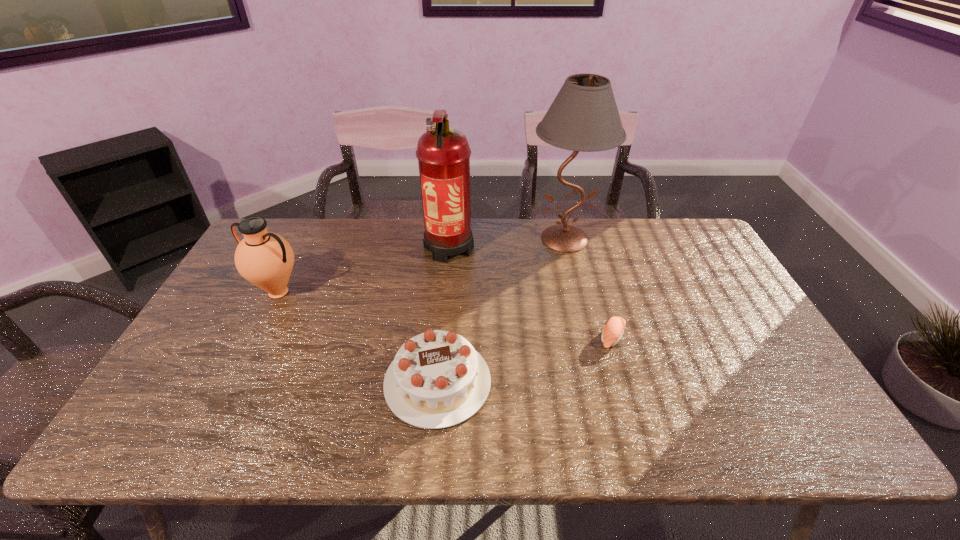
Locate an element on the screen. The image size is (960, 540). free space at the far right corner of the desktop is located at coordinates (667, 237).

You are a GUI agent. You are given a task and a screenshot of the screen. Output one action in this format:
    pyautogui.click(x=<x>, y=<y>)
    Task: Click on the unoccupied area between the fire extinguisher and the shortest object
    Image resolution: width=960 pixels, height=540 pixels.
    Given the screenshot: What is the action you would take?
    pyautogui.click(x=531, y=292)

The image size is (960, 540). I want to click on empty space between the fire extinguisher and the pitcher, so click(364, 269).

Locate an element on the screen. unoccupied position between the birthday cake and the shortest object is located at coordinates (525, 360).

Identify the location of vacant area that lies between the sushi and the fire extinguisher. Image resolution: width=960 pixels, height=540 pixels. (531, 292).

The width and height of the screenshot is (960, 540). What are the coordinates of `vacant region between the birthday cake and the leftmost object` in the screenshot? It's located at (358, 337).

At what (x,y) coordinates should I click in order to perform the action: click on vacant space that's between the leftmost object and the fire extinguisher. Please return your answer as a coordinate pair (x, y). The width and height of the screenshot is (960, 540). Looking at the image, I should click on (364, 269).

You are a GUI agent. You are given a task and a screenshot of the screen. Output one action in this format:
    pyautogui.click(x=<x>, y=<y>)
    Task: Click on the unoccupied position between the fire extinguisher and the sushi
    The image size is (960, 540).
    Given the screenshot: What is the action you would take?
    pyautogui.click(x=531, y=292)

This screenshot has width=960, height=540. Identify the location of vacant region between the table lamp and the shortest object. (588, 288).

Find the location of a particular element. Image resolution: width=960 pixels, height=540 pixels. free space between the table lamp and the sushi is located at coordinates (588, 288).